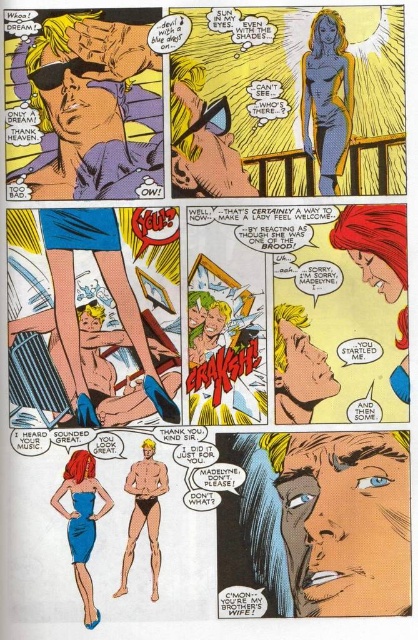
Question: Which object is the closest to the smooth blue shorts at lower left?

Choices:
 (A) blue metallic figure at upper right
 (B) blue satin dress at lower left
 (C) smooth skin face at center

Answer: (B)

Question: Is smooth blue shorts at lower left bigger than blue metallic figure at upper right?

Choices:
 (A) no
 (B) yes

Answer: (B)

Question: Can you confirm if matte black sunglasses at upper left is positioned below blue metallic figure at upper right?

Choices:
 (A) yes
 (B) no

Answer: (A)

Question: Can you confirm if blue metallic figure at upper right is positioned below blue satin dress at lower left?

Choices:
 (A) yes
 (B) no

Answer: (B)

Question: Among these objects, which one is farthest from the camera?

Choices:
 (A) blue metallic figure at upper right
 (B) smooth tan skin at lower center

Answer: (A)

Question: Which of the following is the farthest from the observer?

Choices:
 (A) smooth blue shorts at lower left
 (B) smooth tan skin at lower center
 (C) blue satin dress at lower left

Answer: (A)